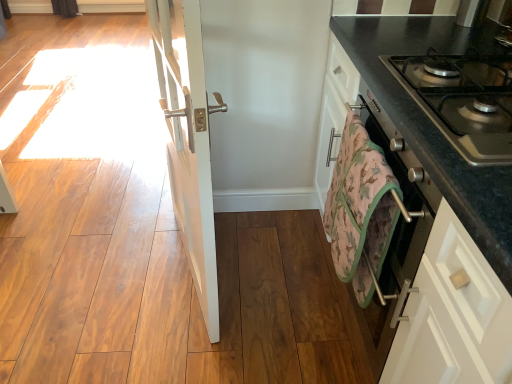
Question: Does point (472, 87) appear closer or farther from the camera than point (183, 44)?

Choices:
 (A) farther
 (B) closer

Answer: (A)

Question: Is metallic gray gas stove at right spatially inside white glossy door at center, or outside of it?

Choices:
 (A) inside
 (B) outside

Answer: (B)

Question: Estimate the real-world distances between objects in this image. Which object is farther from the metallic gray gas stove at right?

Choices:
 (A) camouflage-patterned towel at lower right
 (B) black granite countertop at right
 (C) white glossy door at center

Answer: (C)

Question: Which object is the farthest from the black granite countertop at right?

Choices:
 (A) camouflage-patterned towel at lower right
 (B) white glossy door at center
 (C) metallic gray gas stove at right

Answer: (B)